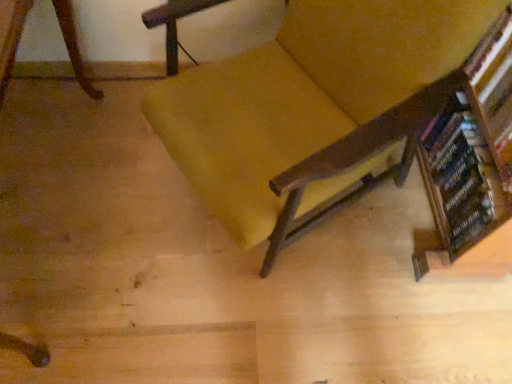
Question: Is wooden bookshelf at right shorter than wooden bookcase at right?

Choices:
 (A) no
 (B) yes

Answer: (B)

Question: Is wooden bookshelf at right far away from wooden bookcase at right?

Choices:
 (A) yes
 (B) no

Answer: (B)

Question: From the image's perspective, is wooden bookshelf at right over wooden bookcase at right?

Choices:
 (A) no
 (B) yes

Answer: (B)

Question: Is wooden bookshelf at right oriented towards wooden bookcase at right?

Choices:
 (A) no
 (B) yes

Answer: (A)

Question: Is the depth of wooden bookshelf at right greater than that of wooden bookcase at right?

Choices:
 (A) no
 (B) yes

Answer: (A)

Question: Is wooden bookshelf at right thinner than wooden bookcase at right?

Choices:
 (A) no
 (B) yes

Answer: (A)

Question: Is velvet yellow chair at center placed right next to wooden bookcase at right?

Choices:
 (A) no
 (B) yes

Answer: (A)

Question: From a real-world perspective, is velvet yellow chair at center on top of wooden bookcase at right?

Choices:
 (A) yes
 (B) no

Answer: (A)

Question: Does velvet yellow chair at center turn towards wooden bookcase at right?

Choices:
 (A) yes
 (B) no

Answer: (B)

Question: Considering the relative positions of velvet yellow chair at center and wooden bookcase at right in the image provided, is velvet yellow chair at center behind wooden bookcase at right?

Choices:
 (A) no
 (B) yes

Answer: (A)

Question: From the image's perspective, is velvet yellow chair at center located beneath wooden bookcase at right?

Choices:
 (A) yes
 (B) no

Answer: (B)

Question: Does velvet yellow chair at center appear on the left side of wooden bookcase at right?

Choices:
 (A) no
 (B) yes

Answer: (B)

Question: Is wooden bookshelf at right bigger than velvet yellow chair at center?

Choices:
 (A) no
 (B) yes

Answer: (A)